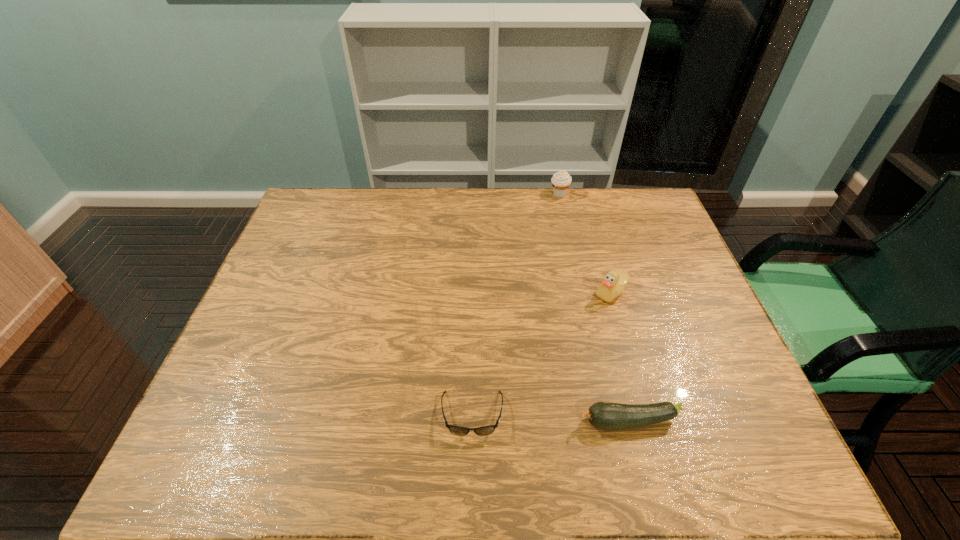
I want to click on free space that is in between the third tallest object and the second farthest object, so click(x=619, y=357).

Find the location of `empty location between the farthest object and the duck`. empty location between the farthest object and the duck is located at coordinates (585, 243).

Select which object appears as the closest to the farthest object. Please provide its 2D coordinates. Your answer should be formatted as a tuple, i.e. [(x, y)], where the tuple contains the x and y coordinates of a point satisfying the conditions above.

[(613, 284)]

Find the location of `the second closest object to the leftmost object`. the second closest object to the leftmost object is located at coordinates (613, 284).

Image resolution: width=960 pixels, height=540 pixels. I want to click on free point that satisfies the following two spatial constraints: 1. at the beak of the duck; 2. on the front-facing side of the shortest object, so [646, 414].

Locate an element on the screen. vacant region that satisfies the following two spatial constraints: 1. at the beak of the third nearest object; 2. on the front-facing side of the shortest object is located at coordinates (646, 414).